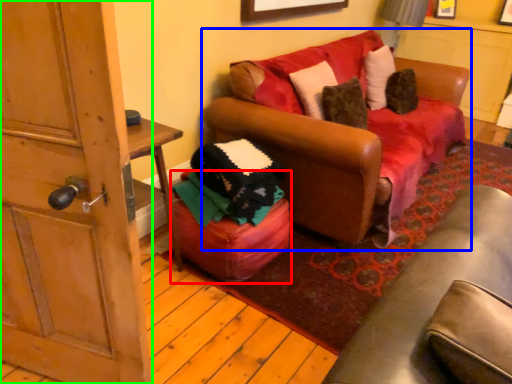
Question: Considering the real-world distances, which object is farthest from stool (highlighted by a red box)? studio couch (highlighted by a blue box) or door (highlighted by a green box)?

Choices:
 (A) studio couch
 (B) door

Answer: (B)